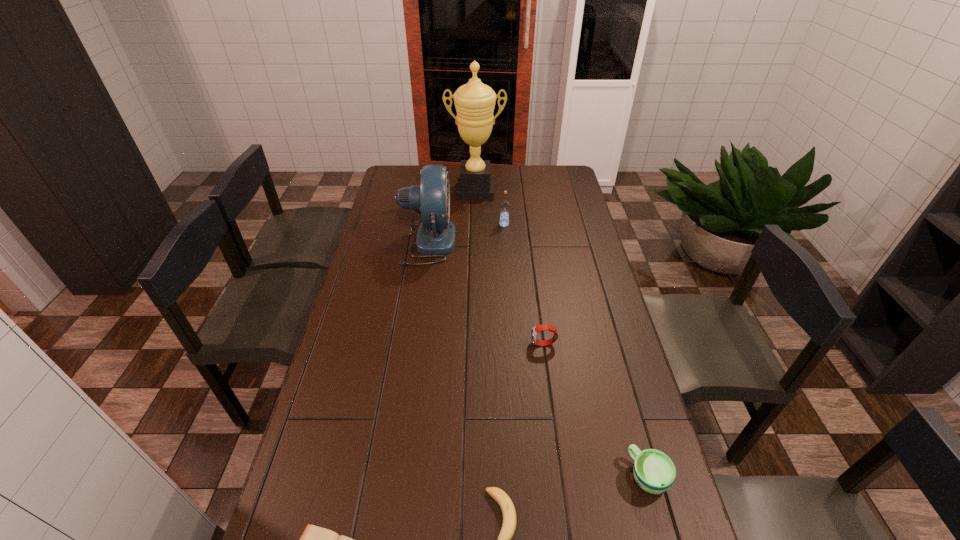
Identify which object is located as the nearest to the rightmost object. Please provide its 2D coordinates. Your answer should be formatted as a tuple, i.e. [(x, y)], where the tuple contains the x and y coordinates of a point satisfying the conditions above.

[(508, 528)]

Find the location of a particular element. Image resolution: width=960 pixels, height=540 pixels. object identified as the fifth closest to the vodka is located at coordinates (508, 528).

At what (x,y) coordinates should I click in order to perform the action: click on free spot that satisfies the following two spatial constraints: 1. on the face of the sixth object from left to right; 2. on the back side of the cup. Please return your answer as a coordinate pair (x, y). This screenshot has width=960, height=540. Looking at the image, I should click on (562, 476).

I want to click on free space that satisfies the following two spatial constraints: 1. at the front of the cup with handles; 2. on the left side of the trophy cup, so click(471, 476).

Find the location of a particular element. free space that satisfies the following two spatial constraints: 1. on the face of the fourth nearest object; 2. on the back side of the rightmost object is located at coordinates (562, 476).

At what (x,y) coordinates should I click in order to perform the action: click on vacant space that satisfies the following two spatial constraints: 1. on the front side of the rightmost object; 2. on the left side of the vodka. Please return your answer as a coordinate pair (x, y). The image size is (960, 540). Looking at the image, I should click on (522, 476).

You are a GUI agent. You are given a task and a screenshot of the screen. Output one action in this format:
    pyautogui.click(x=<x>, y=<y>)
    Task: Click on the vacant space that satisfies the following two spatial constraints: 1. at the front of the tallest object with handles; 2. on the right side of the fifth shortest object
    This screenshot has width=960, height=540.
    Given the screenshot: What is the action you would take?
    pyautogui.click(x=475, y=225)

Where is `free space that satisfies the following two spatial constraints: 1. at the front of the tallest object with handles; 2. on the right side of the cup`? free space that satisfies the following two spatial constraints: 1. at the front of the tallest object with handles; 2. on the right side of the cup is located at coordinates (471, 476).

Identify the location of free space that satisfies the following two spatial constraints: 1. on the face of the watch; 2. on the right side of the rightmost object. (562, 476).

Find the location of `vacant space that satisfies the following two spatial constraints: 1. at the front of the trophy cup with handles; 2. in front of the fan to blow air`. vacant space that satisfies the following two spatial constraints: 1. at the front of the trophy cup with handles; 2. in front of the fan to blow air is located at coordinates (475, 242).